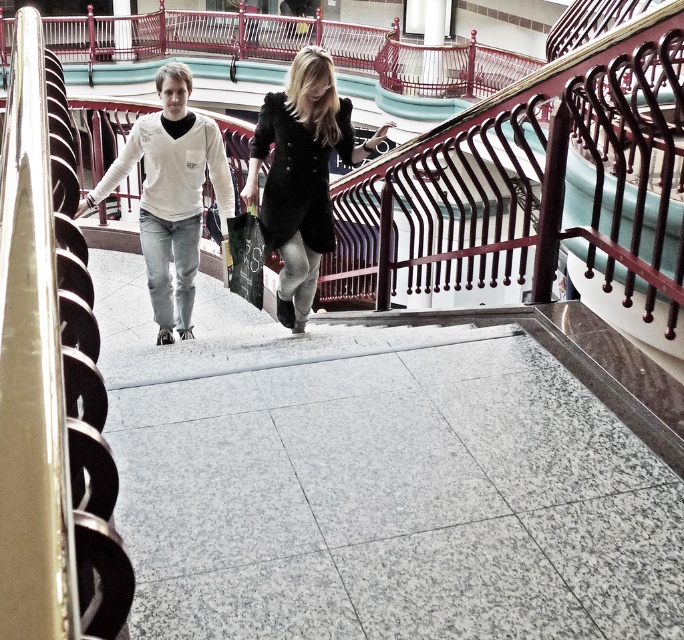
Question: Can you confirm if black wool coat at center is smaller than white matte sweater at left?

Choices:
 (A) no
 (B) yes

Answer: (B)

Question: Is black wool coat at center positioned behind matte black handbag at upper center?

Choices:
 (A) no
 (B) yes

Answer: (A)

Question: Which object appears farthest from the camera in this image?

Choices:
 (A) black wool coat at center
 (B) matte black handbag at upper center

Answer: (B)

Question: Does white matte sweater at left appear under matte black handbag at upper center?

Choices:
 (A) yes
 (B) no

Answer: (B)

Question: Which point appears closest to the camera in this image?

Choices:
 (A) (304, 227)
 (B) (163, 152)

Answer: (A)

Question: Which object is closer to the camera taking this photo?

Choices:
 (A) matte black handbag at upper center
 (B) white matte sweater at left

Answer: (A)